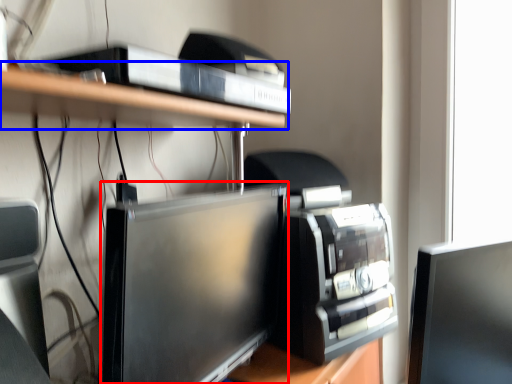
Question: Which of the following is the farthest to the observer, computer monitor (highlighted by a red box) or shelf (highlighted by a blue box)?

Choices:
 (A) computer monitor
 (B) shelf

Answer: (B)